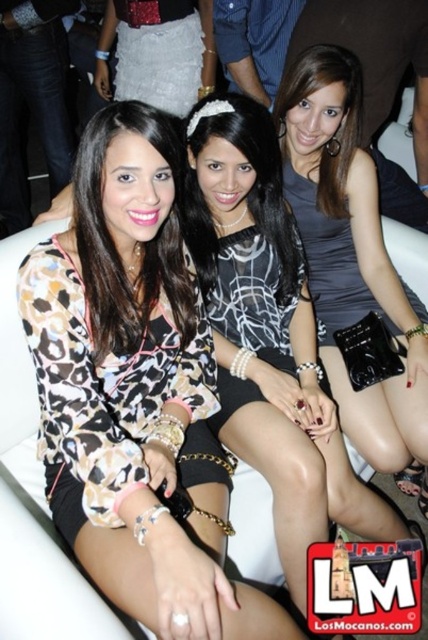
You are a photographer at the party and want to take a photo of the black and white printed blouse at center and the silver metallic skirt at upper left. Based on their positions, which one should you focus on first if you start from the left side of the image?

The silver metallic skirt at upper left should be focused on first since it is positioned to the left of the black and white printed blouse at center.

You are standing at the point marked as point (282,104) in the image. You want to greet the woman on the right who is wearing a sleeve. Can you reach her without moving from your current position?

The distance between you and the woman on the right who is wearing a sleeve is 4.82 feet. Since you are 4.82 feet apart, you can comfortably reach her without moving from your current position.

You are a photographer trying to capture a group photo of the black and white printed blouse at center and the silver metallic skirt at upper left. Based on their positions, which one would you need to frame wider to ensure both are fully visible in the photo?

The black and white printed blouse at center might be wider than silver metallic skirt at upper left, so you should frame the black and white printed blouse at center wider to ensure both are fully visible in the photo.